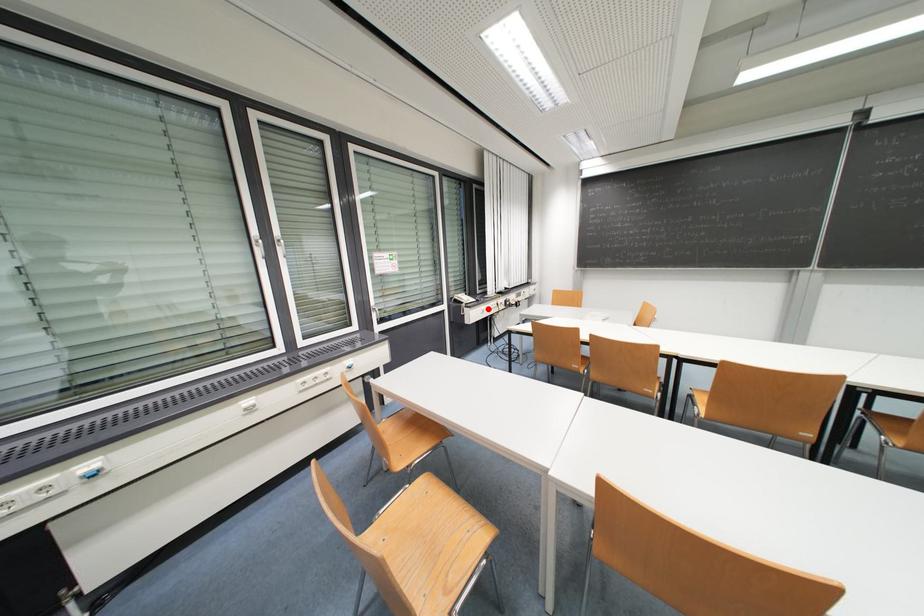
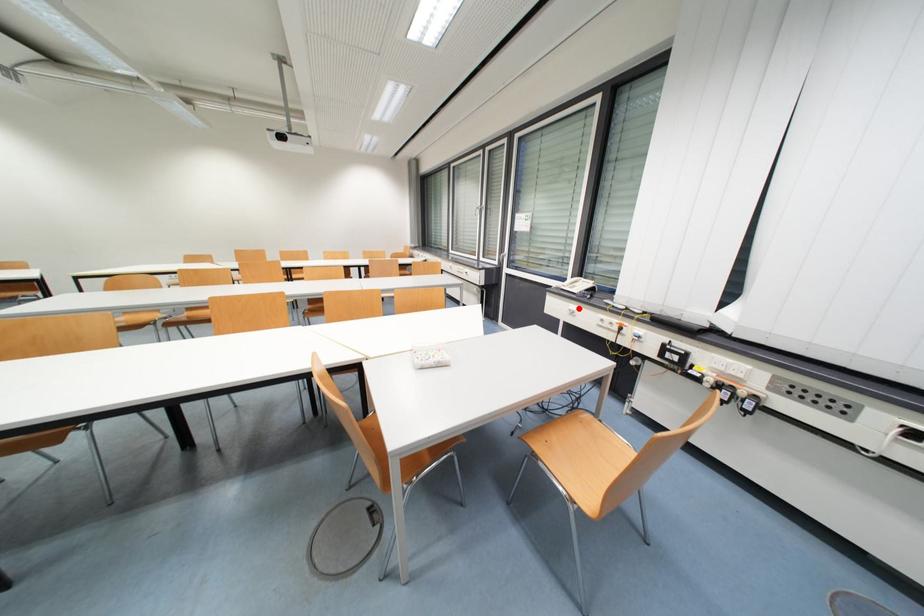
I am providing you with two images of the same scene from different viewpoints. A red point is marked on the first image and another point is marked on the second image. Does the point marked in image1 correspond to the same location as the one in image2?

Yes